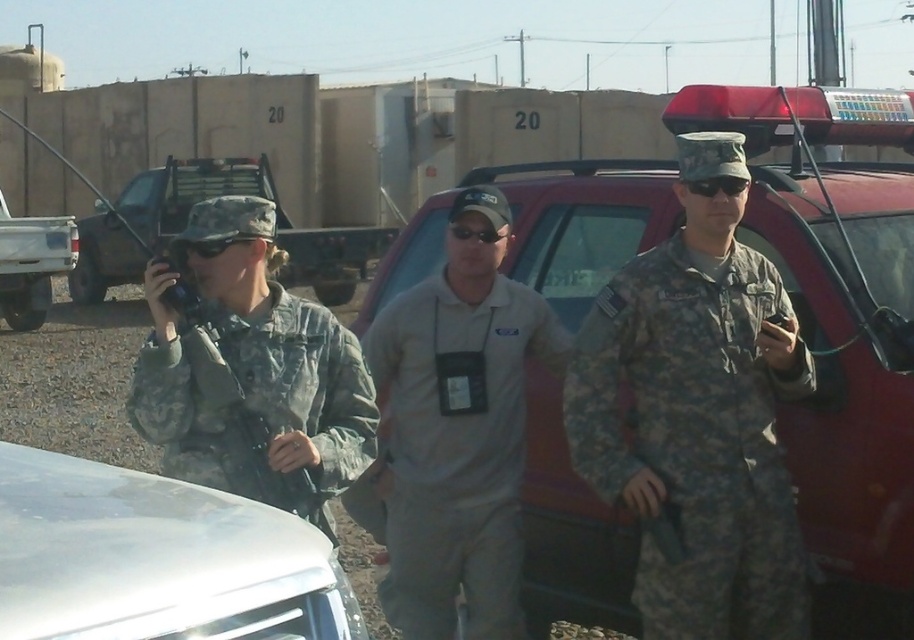
You are a driver who needs to park your vehicle in this area. The matte red truck at center and the white glossy car at lower left are already parked. Which vehicle takes up more space in the parking area?

The matte red truck at center takes up more space in the parking area as it is larger than the white glossy car at lower left.

You are a photographer positioned in the desert scene. You want to take a photo that includes both the matte red truck at center and the gray fabric shirt at center. Which object should you adjust your camera focus to first to ensure it appears sharp in the final image?

The matte red truck at center is further to the viewer than the gray fabric shirt at center, so you should focus on the matte red truck at center first to ensure it is sharp before adjusting for the other object.